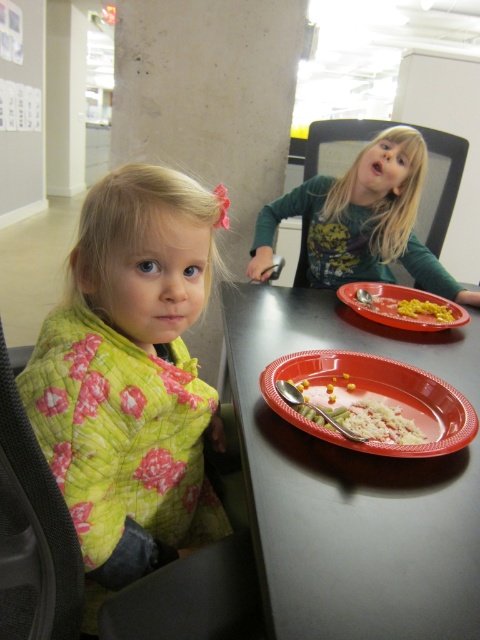
Can you confirm if green quilted blanket at left is positioned below red plastic table at center?

Yes, green quilted blanket at left is below red plastic table at center.

Which of these two, green quilted blanket at left or red plastic table at center, stands shorter?

red plastic table at center is shorter.

Does point (106, 353) lie in front of point (254, 552)?

No, it is behind (254, 552).

The width and height of the screenshot is (480, 640). What are the coordinates of `green quilted blanket at left` in the screenshot? It's located at (132, 374).

Can you confirm if green textured shirt at upper right is wider than orange plastic plate at center?

Correct, the width of green textured shirt at upper right exceeds that of orange plastic plate at center.

Is green textured shirt at upper right positioned behind orange plastic plate at center?

Yes, it is.

Is point (393, 248) in front of point (453, 435)?

That is False.

What are the coordinates of `green textured shirt at upper right` in the screenshot? It's located at (361, 220).

Is point (312, 332) positioned in front of point (269, 365)?

No.

Does red plastic table at center come in front of orange plastic plate at center?

That is True.

Where is `red plastic table at center`? red plastic table at center is located at coordinates (352, 484).